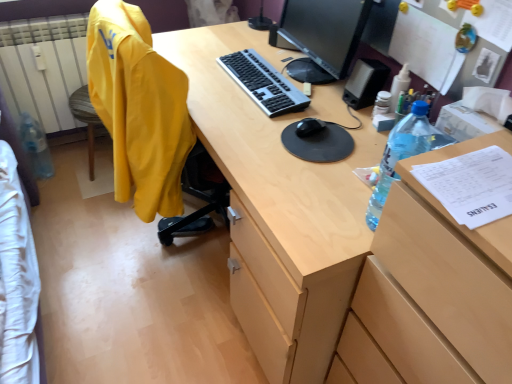
Where is `vacant space behind silver/black plastic keyboard at center`? The width and height of the screenshot is (512, 384). vacant space behind silver/black plastic keyboard at center is located at coordinates (253, 46).